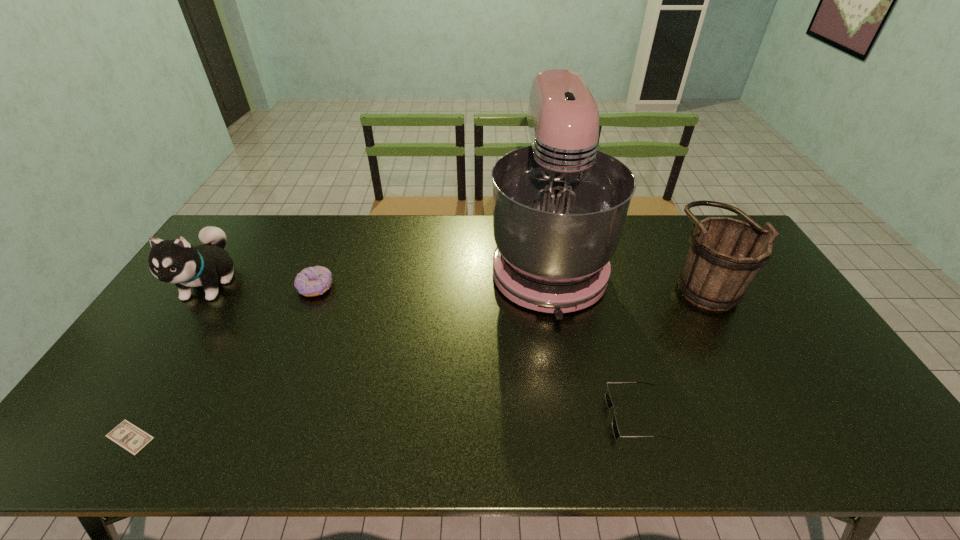
Find the location of `the tallest object`. the tallest object is located at coordinates (559, 206).

Where is `bucket`? The image size is (960, 540). bucket is located at coordinates (725, 255).

The height and width of the screenshot is (540, 960). I want to click on puppy, so click(x=177, y=262).

Identify the location of the fourth tallest object. (313, 281).

Identify the location of the fourth object from right to left. (x=313, y=281).

This screenshot has width=960, height=540. What are the coordinates of `the second shortest object` in the screenshot? It's located at (609, 403).

Locate an element on the screen. The width and height of the screenshot is (960, 540). money is located at coordinates (127, 435).

Where is `free location located 0.130m on the front-facing side of the tallest object`? The height and width of the screenshot is (540, 960). free location located 0.130m on the front-facing side of the tallest object is located at coordinates (564, 363).

This screenshot has height=540, width=960. I want to click on free space located on the handle side of the bucket, so click(x=642, y=280).

Locate an element on the screen. Image resolution: width=960 pixels, height=540 pixels. blank area located 0.380m on the handle side of the bucket is located at coordinates (549, 280).